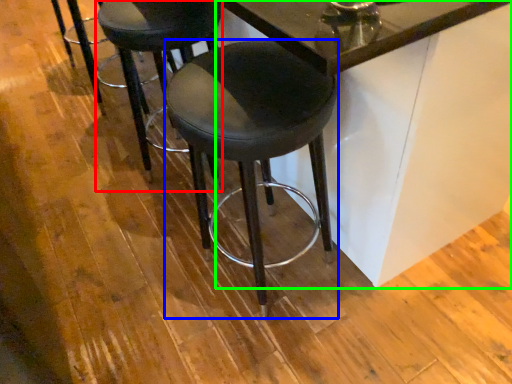
Question: Estimate the real-world distances between objects in this image. Which object is farther from stool (highlighted by a red box), stool (highlighted by a blue box) or table (highlighted by a green box)?

Choices:
 (A) stool
 (B) table

Answer: (B)